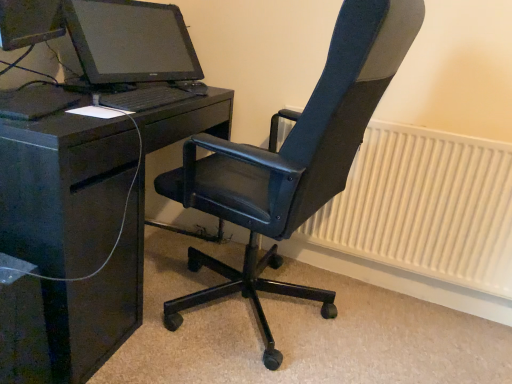
This screenshot has width=512, height=384. Find the location of `vacant area situated below white textured radiator at right (from a real-world perspective)`. vacant area situated below white textured radiator at right (from a real-world perspective) is located at coordinates (376, 285).